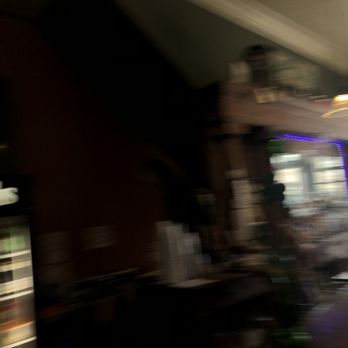
Where is `mirror`? This screenshot has height=348, width=348. mirror is located at coordinates pos(305,155).